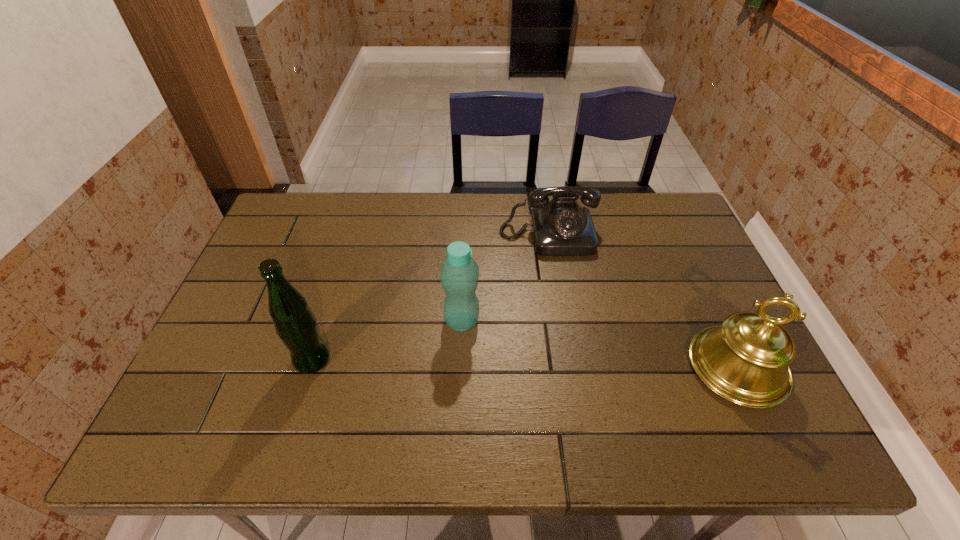
Where is `vacant space located on the dial of the telephone`? The width and height of the screenshot is (960, 540). vacant space located on the dial of the telephone is located at coordinates (571, 362).

You are a GUI agent. You are given a task and a screenshot of the screen. Output one action in this format:
    pyautogui.click(x=<x>, y=<y>)
    Task: Click on the vacant space located 0.330m at the front cap of the second object from left to right
    
    Given the screenshot: What is the action you would take?
    pyautogui.click(x=595, y=395)

Find the location of `free space located 0.320m at the front cap of the second object from left to right`. free space located 0.320m at the front cap of the second object from left to right is located at coordinates (591, 393).

Locate an element on the screen. The image size is (960, 540). blank space located 0.150m at the front cap of the second object from left to right is located at coordinates (527, 357).

This screenshot has width=960, height=540. I want to click on object situated at the far edge, so click(x=561, y=227).

Locate an element on the screen. The height and width of the screenshot is (540, 960). beer bottle present at the near edge is located at coordinates (295, 324).

The height and width of the screenshot is (540, 960). I want to click on bell that is positioned at the near edge, so click(x=745, y=360).

Find the location of a particular element. The height and width of the screenshot is (540, 960). object that is at the right edge is located at coordinates (745, 360).

The height and width of the screenshot is (540, 960). I want to click on object situated at the near right corner, so [x=745, y=360].

Find the location of a particular element. The width and height of the screenshot is (960, 540). free point at the far edge is located at coordinates (493, 200).